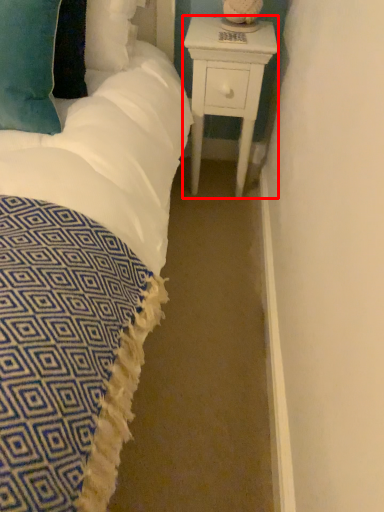
Question: From the image's perspective, where is nightstand (annotated by the red box) located in relation to pillow in the image?

Choices:
 (A) above
 (B) below

Answer: (B)